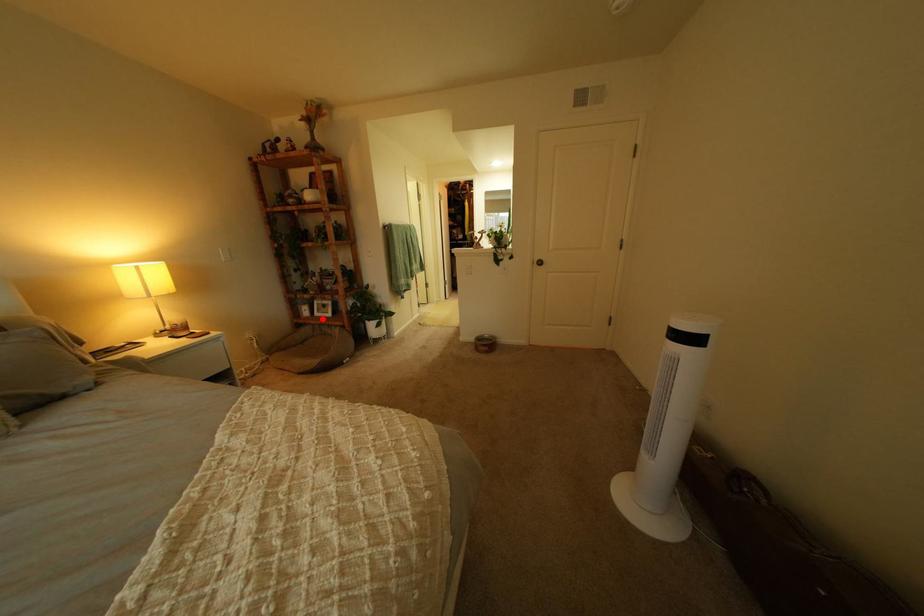
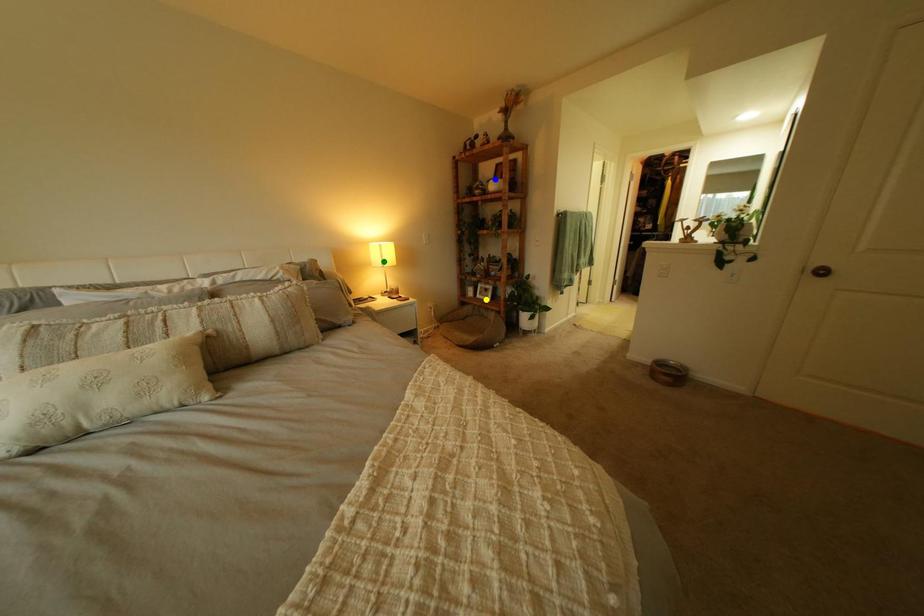
Question: I am providing you with two images of the same scene from different viewpoints. A red point is marked on the first image. You are given multiple points on the second image. Can you choose the point in image 2 that corresponds to the point in image 1?

Choices:
 (A) green point
 (B) blue point
 (C) yellow point

Answer: (C)